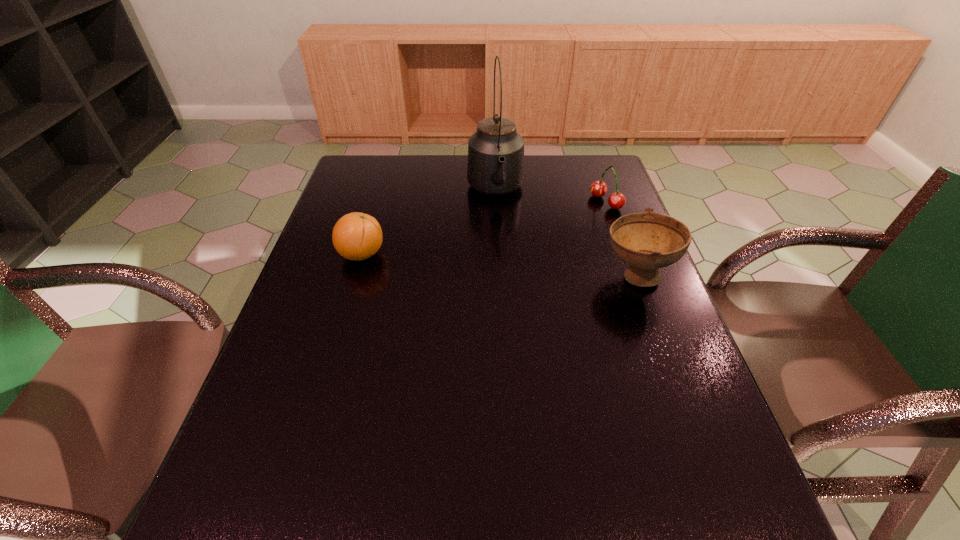
At what (x,y) coordinates should I click in order to perform the action: click on free space on the desktop that is between the leftmost object and the second tallest object and is positioned with stems pointing upwards on the cherry. Please return your answer as a coordinate pair (x, y). Image resolution: width=960 pixels, height=540 pixels. Looking at the image, I should click on (455, 262).

At what (x,y) coordinates should I click in order to perform the action: click on vacant space on the desktop that is between the leftmost object and the second tallest object and is positioned spout on the tallest object. Please return your answer as a coordinate pair (x, y). This screenshot has height=540, width=960. Looking at the image, I should click on (509, 266).